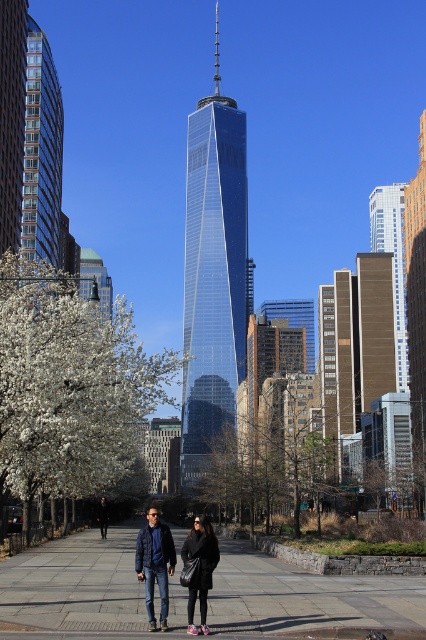
Question: Is white blossoming tree at lower left above shiny glass skyscraper at center?

Choices:
 (A) no
 (B) yes

Answer: (A)

Question: Among these objects, which one is farthest from the camera?

Choices:
 (A) glassy steel skyscraper at center
 (B) green glass bell at upper left
 (C) white blossoming tree at lower left
 (D) navy blue jacket at center

Answer: (A)

Question: Is brown textured building at center thinner than green glass bell at upper left?

Choices:
 (A) no
 (B) yes

Answer: (B)

Question: Where is navy blue jacket at center located in relation to black leather jacket at center in the image?

Choices:
 (A) above
 (B) below

Answer: (B)

Question: Estimate the real-world distances between objects in this image. Which object is closer to the white blossoming tree at lower left?

Choices:
 (A) green glass bell at upper left
 (B) navy blue jacket at center
 (C) shiny glass skyscraper at center

Answer: (B)

Question: Which object is the closest to the green glass bell at upper left?

Choices:
 (A) matte black jacket at center
 (B) glassy steel skyscraper at center

Answer: (B)